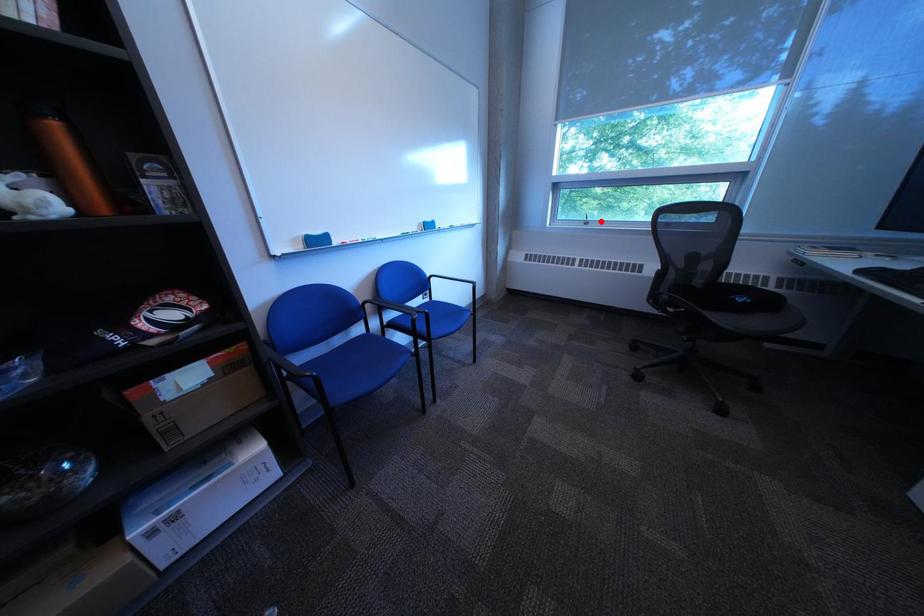
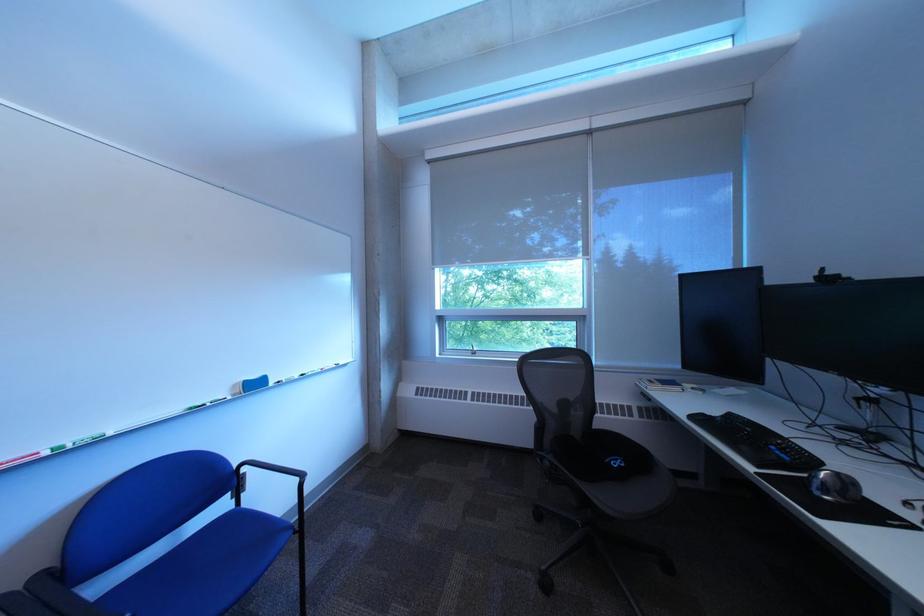
Question: I am providing you with two images of the same scene from different viewpoints. A red point is shown in image1. For the corresponding object point in image2, is it positioned nearer or farther from the camera?

Choices:
 (A) Nearer
 (B) Farther

Answer: (A)